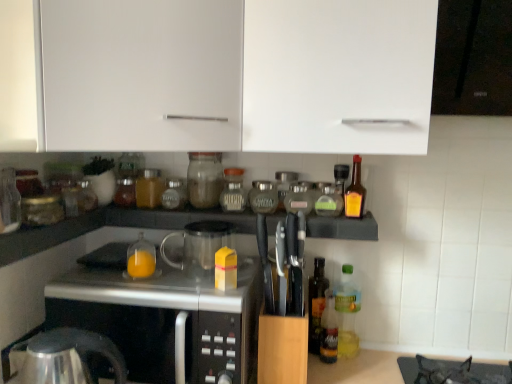
This screenshot has height=384, width=512. Find the location of `free space that is in between translucent glass bottle at center, the 1th orange juice positioned from the back, and translucent plastic carton at center, the second orange juice viewed from the back`. free space that is in between translucent glass bottle at center, the 1th orange juice positioned from the back, and translucent plastic carton at center, the second orange juice viewed from the back is located at coordinates (179, 283).